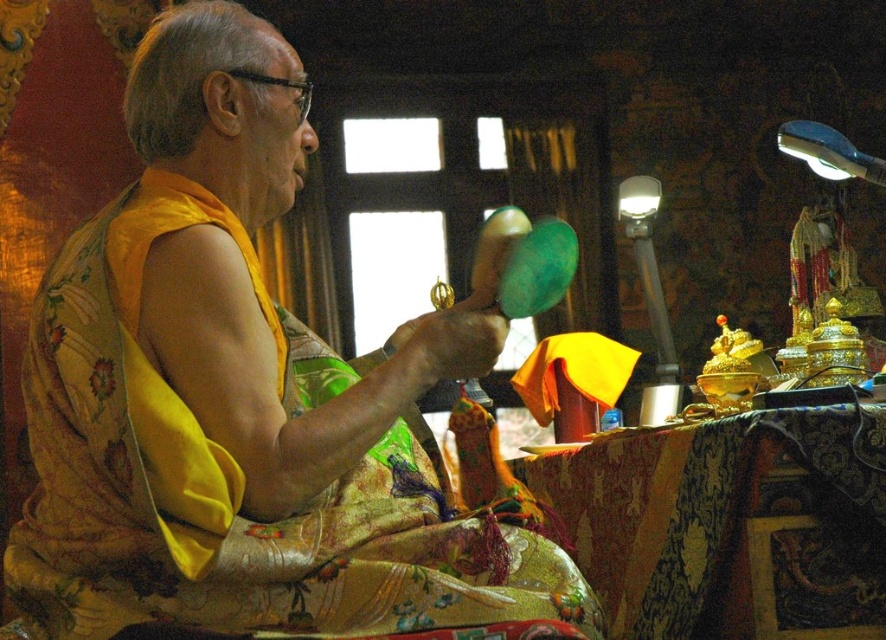
What do you see at coordinates (242, 397) in the screenshot?
I see `silky yellow robe at center` at bounding box center [242, 397].

Who is shorter, silky yellow robe at center or gold-patterned cloth at lower right?

gold-patterned cloth at lower right is shorter.

Find the location of a particular element. silky yellow robe at center is located at coordinates (242, 397).